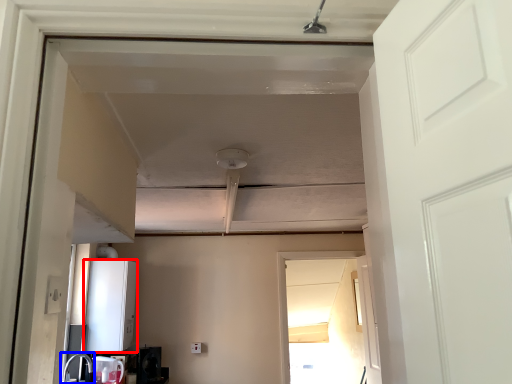
Question: Which object is closer to the camera taking this photo, appliance (highlighted by a red box) or sink (highlighted by a blue box)?

Choices:
 (A) appliance
 (B) sink

Answer: (B)